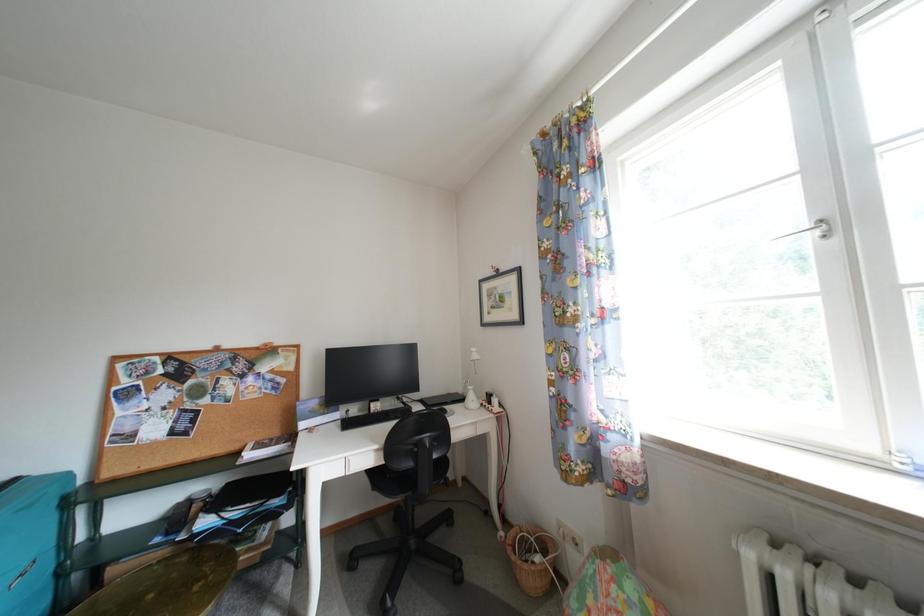
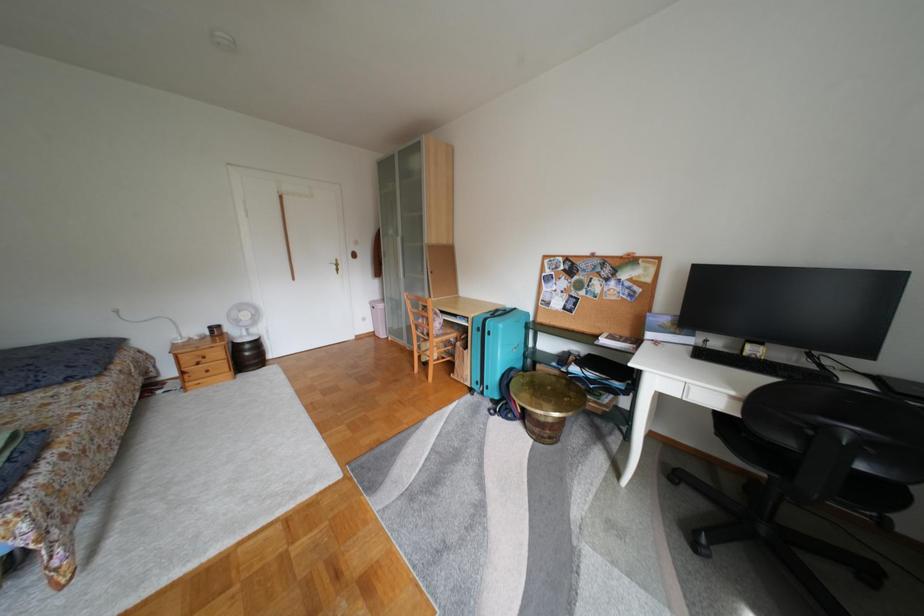
How did the camera likely rotate?

The camera rotated toward left-down.